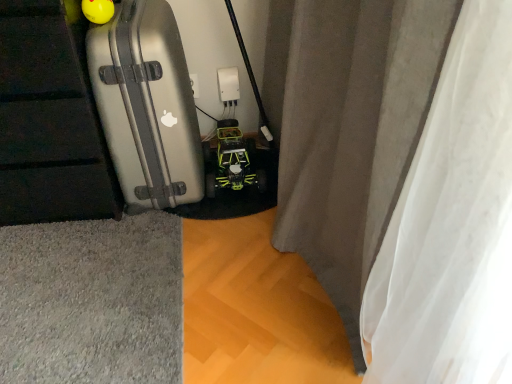
Question: Is gray fabric curtain at center in contact with silver metallic suitcase at left?

Choices:
 (A) no
 (B) yes

Answer: (A)

Question: Can you confirm if gray fabric curtain at center is positioned to the right of silver metallic suitcase at left?

Choices:
 (A) yes
 (B) no

Answer: (A)

Question: Is gray fabric curtain at center outside of silver metallic suitcase at left?

Choices:
 (A) no
 (B) yes

Answer: (B)

Question: From a real-world perspective, is gray fabric curtain at center positioned under silver metallic suitcase at left based on gravity?

Choices:
 (A) no
 (B) yes

Answer: (A)

Question: Is gray fabric curtain at center turned away from silver metallic suitcase at left?

Choices:
 (A) yes
 (B) no

Answer: (B)

Question: Considering their positions, is yellow-green plastic toy car at center located in front of or behind gray fabric curtain at center?

Choices:
 (A) behind
 (B) front

Answer: (A)

Question: Is point (228, 178) closer or farther from the camera than point (270, 8)?

Choices:
 (A) closer
 (B) farther

Answer: (B)

Question: In terms of size, does yellow-green plastic toy car at center appear bigger or smaller than gray fabric curtain at center?

Choices:
 (A) big
 (B) small

Answer: (B)

Question: Considering the relative positions of yellow-green plastic toy car at center and gray fabric curtain at center in the image provided, is yellow-green plastic toy car at center to the left or to the right of gray fabric curtain at center?

Choices:
 (A) right
 (B) left

Answer: (B)

Question: Looking at their shapes, would you say silver metallic suitcase at left is wider or thinner than yellow-green plastic toy car at center?

Choices:
 (A) wide
 (B) thin

Answer: (A)

Question: Based on their sizes in the image, would you say silver metallic suitcase at left is bigger or smaller than yellow-green plastic toy car at center?

Choices:
 (A) big
 (B) small

Answer: (A)

Question: Visually, is silver metallic suitcase at left positioned to the left or to the right of yellow-green plastic toy car at center?

Choices:
 (A) right
 (B) left

Answer: (B)

Question: From a real-world perspective, is silver metallic suitcase at left above or below yellow-green plastic toy car at center?

Choices:
 (A) above
 (B) below

Answer: (A)

Question: In terms of size, does silver metallic suitcase at left appear bigger or smaller than gray fabric curtain at center?

Choices:
 (A) small
 (B) big

Answer: (A)

Question: From the image's perspective, is silver metallic suitcase at left above or below gray fabric curtain at center?

Choices:
 (A) above
 (B) below

Answer: (A)